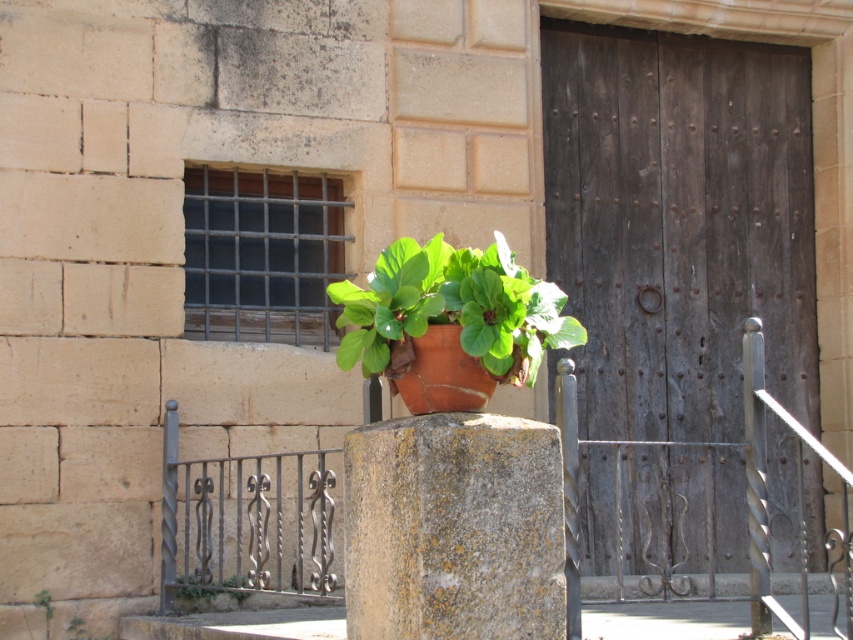
Which of these two, dark brown wooden door at center or green leafy plant at lower center, stands taller?

dark brown wooden door at center

The height and width of the screenshot is (640, 853). What do you see at coordinates (679, 225) in the screenshot? I see `dark brown wooden door at center` at bounding box center [679, 225].

Where is `dark brown wooden door at center`? dark brown wooden door at center is located at coordinates (679, 225).

Which of these two, dark brown wooden door at center or terracotta pot at center, stands shorter?

terracotta pot at center

At what (x,y) coordinates should I click in order to perform the action: click on dark brown wooden door at center. Please return your answer as a coordinate pair (x, y). The width and height of the screenshot is (853, 640). Looking at the image, I should click on (679, 225).

Which is in front, point (781, 257) or point (494, 280)?

Positioned in front is point (494, 280).

The width and height of the screenshot is (853, 640). Find the location of `dark brown wooden door at center`. dark brown wooden door at center is located at coordinates (679, 225).

Between dark brown wooden door at center and rusty stone pillar at center, which one appears on the right side from the viewer's perspective?

dark brown wooden door at center is more to the right.

Identify the location of dark brown wooden door at center. (679, 225).